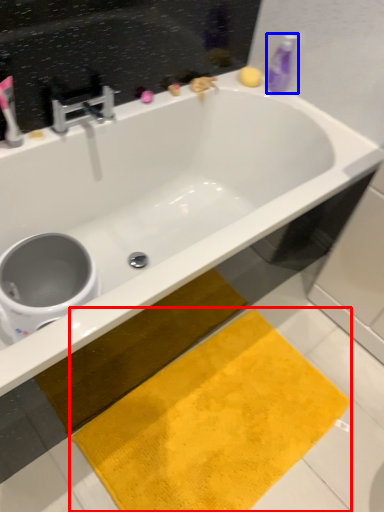
Question: Among these objects, which one is nearest to the camera, beach towel (highlighted by a red box) or cleaning product (highlighted by a blue box)?

Choices:
 (A) beach towel
 (B) cleaning product

Answer: (A)